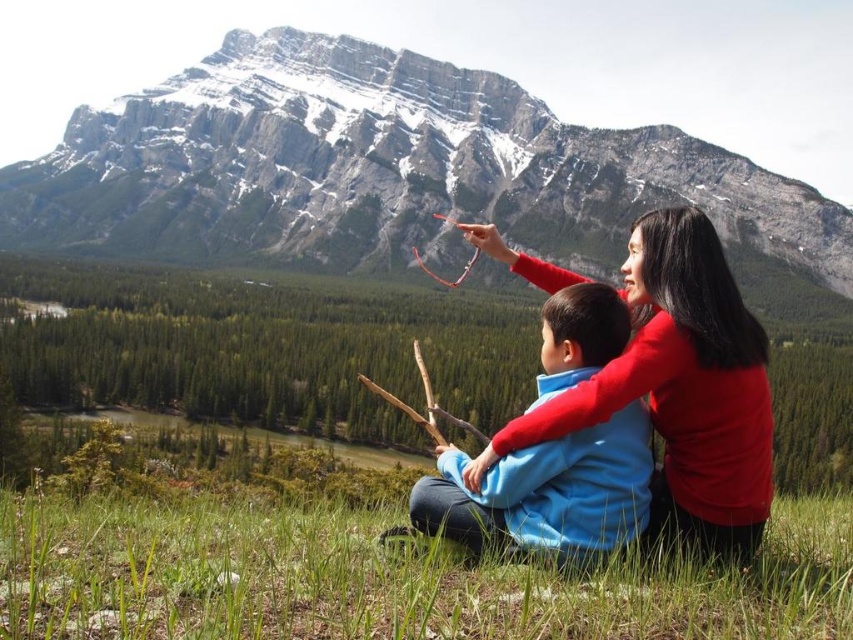
In the scene shown: You are a hiker planning to take a photo of the snowy granite mountain at upper center and the red matte sweater at center. If you want both objects to be clearly visible in your photo, which one should you focus on first?

The red matte sweater at center is closer to you than the snowy granite mountain at upper center, so you should focus on the red matte sweater at center first to ensure both are in focus.

You are a photographer trying to capture both the red matte sweater at center and the blue fleece jacket at center in a single frame. Based on their positions, which object should you focus on to ensure both are in the frame without moving the camera?

You should focus on the red matte sweater at center because it is wider than the blue fleece jacket at center, so centering on the wider object increases the likelihood that both will fit within the frame.